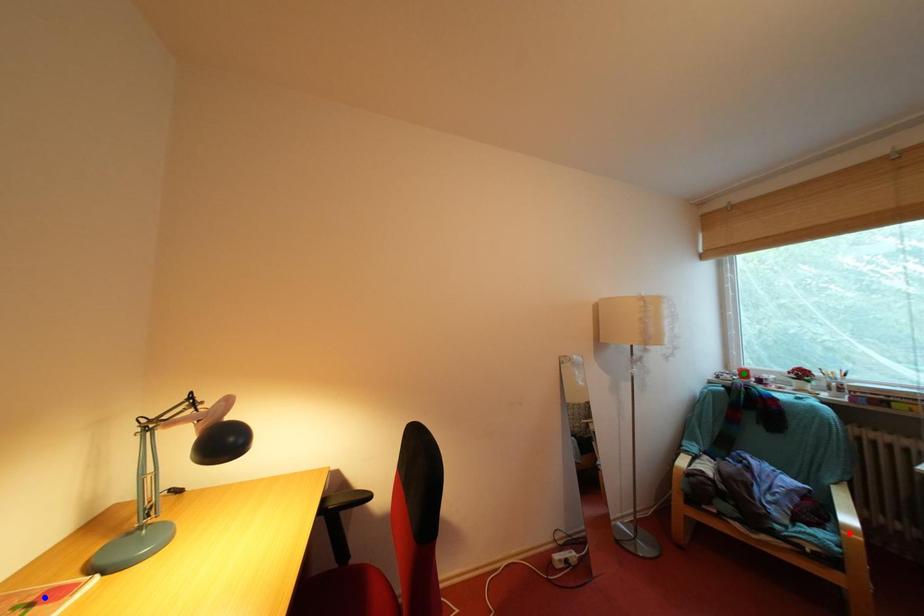
Order these from nearest to farthest:
1. blue point
2. green point
3. red point

blue point, red point, green point